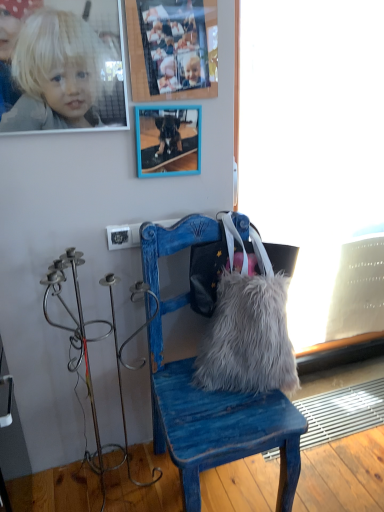
Measure the distance between point (244,432) and camera.

Point (244,432) and camera are 1.26 meters apart from each other.

The image size is (384, 512). In order to click on blue wooden chair at center in this screenshot , I will do `click(217, 421)`.

The height and width of the screenshot is (512, 384). I want to click on wooden photo frame at upper center, which appears as the second picture frame when ordered from the bottom, so (x=172, y=49).

Describe the element at coordinates (56, 72) in the screenshot. I see `blonde hair at upper left` at that location.

This screenshot has width=384, height=512. Describe the element at coordinates (168, 140) in the screenshot. I see `blue wooden picture frame at upper center, the 2th picture frame viewed from the top` at that location.

Locate an element on the screen. blue wooden chair at center is located at coordinates (217, 421).

Measure the distance between fuzzy fabric handbag at center and blonde hair at upper left.

30.07 inches.

The image size is (384, 512). I want to click on person that is above the fuzzy fabric handbag at center (from a real-world perspective), so click(x=56, y=72).

In terms of height, does fuzzy fabric handbag at center look taller or shorter compared to blonde hair at upper left?

Considering their sizes, fuzzy fabric handbag at center has more height than blonde hair at upper left.

Is fuzzy fabric handbag at center positioned with its back to blonde hair at upper left?

No.

Is fuzzy fabric handbag at center facing towards blue wooden picture frame at upper center, the first picture frame when ordered from bottom to top?

No.

Is fuzzy fabric handbag at center not near blue wooden picture frame at upper center, the first picture frame when ordered from bottom to top?

No, fuzzy fabric handbag at center is in close proximity to blue wooden picture frame at upper center, the first picture frame when ordered from bottom to top.

Can you tell me how much fuzzy fabric handbag at center and blue wooden picture frame at upper center, the first picture frame when ordered from bottom to top, differ in facing direction?

1.64 degrees.

Consider the image. From the image's perspective, who appears lower, fuzzy fabric handbag at center or blue wooden picture frame at upper center, the 2th picture frame viewed from the top?

From the image's view, fuzzy fabric handbag at center is below.

Find the location of a particular element. Image resolution: width=384 pixels, height=512 pixels. chair below the blonde hair at upper left (from a real-world perspective) is located at coordinates (217, 421).

From a real-world perspective, does blue wooden chair at center sit lower than blonde hair at upper left?

Yes, from a real-world perspective, blue wooden chair at center is beneath blonde hair at upper left.

How many degrees apart are the facing directions of blue wooden chair at center and blonde hair at upper left?

The angle between the facing direction of blue wooden chair at center and the facing direction of blonde hair at upper left is 0.779 degrees.

Is blue wooden chair at center next to blonde hair at upper left?

blue wooden chair at center and blonde hair at upper left are clearly separated.

Is wooden photo frame at upper center, placed as the 1th picture frame when sorted from top to bottom, closer to the viewer compared to frosted glass window screen at right?

Yes, the depth of wooden photo frame at upper center, placed as the 1th picture frame when sorted from top to bottom, is less than that of frosted glass window screen at right.

Which point is more forward, (152, 35) or (347, 177)?

The point (152, 35) is in front.

Is wooden photo frame at upper center, placed as the 1th picture frame when sorted from top to bottom, far from frosted glass window screen at right?

They are positioned close to each other.

From a real-world perspective, is wooden photo frame at upper center, which appears as the second picture frame when ordered from the bottom, positioned under frosted glass window screen at right based on gravity?

No.

Is blonde hair at upper left to the left of fuzzy fabric handbag at center from the viewer's perspective?

Yes, blonde hair at upper left is to the left of fuzzy fabric handbag at center.

Considering their positions, is blonde hair at upper left located in front of or behind fuzzy fabric handbag at center?

blonde hair at upper left is positioned closer to the viewer than fuzzy fabric handbag at center.

Is blonde hair at upper left far away from fuzzy fabric handbag at center?

No, blonde hair at upper left is not far away from fuzzy fabric handbag at center.

Looking at this image, from the image's perspective, does blonde hair at upper left appear lower than fuzzy fabric handbag at center?

No, from the image's perspective, blonde hair at upper left is not beneath fuzzy fabric handbag at center.

Can you confirm if fuzzy fabric handbag at center is shorter than frosted glass window screen at right?

Yes.

Is there a large distance between fuzzy fabric handbag at center and frosted glass window screen at right?

No, fuzzy fabric handbag at center is in close proximity to frosted glass window screen at right.

Is point (221, 334) positioned after point (274, 158)?

No.

Is fuzzy fabric handbag at center wider or thinner than frosted glass window screen at right?

Clearly, fuzzy fabric handbag at center has more width compared to frosted glass window screen at right.

Considering the positions of objects blue wooden picture frame at upper center, the 2th picture frame viewed from the top, and wooden photo frame at upper center, which appears as the second picture frame when ordered from the bottom, in the image provided, who is in front, blue wooden picture frame at upper center, the 2th picture frame viewed from the top, or wooden photo frame at upper center, which appears as the second picture frame when ordered from the bottom,?

wooden photo frame at upper center, which appears as the second picture frame when ordered from the bottom, is more forward.

How far apart are blue wooden picture frame at upper center, the 2th picture frame viewed from the top, and wooden photo frame at upper center, placed as the 1th picture frame when sorted from top to bottom?

A distance of 6.17 inches exists between blue wooden picture frame at upper center, the 2th picture frame viewed from the top, and wooden photo frame at upper center, placed as the 1th picture frame when sorted from top to bottom.

Which is more to the left, blue wooden picture frame at upper center, the first picture frame when ordered from bottom to top, or wooden photo frame at upper center, placed as the 1th picture frame when sorted from top to bottom?

blue wooden picture frame at upper center, the first picture frame when ordered from bottom to top, is more to the left.

Considering the sizes of objects blue wooden picture frame at upper center, the 2th picture frame viewed from the top, and wooden photo frame at upper center, which appears as the second picture frame when ordered from the bottom, in the image provided, who is smaller, blue wooden picture frame at upper center, the 2th picture frame viewed from the top, or wooden photo frame at upper center, which appears as the second picture frame when ordered from the bottom,?

Smaller between the two is blue wooden picture frame at upper center, the 2th picture frame viewed from the top.

Identify the location of handbag that appears on the right of blonde hair at upper left. (248, 326).

There is a fuzzy fabric handbag at center. Identify the location of the 1st picture frame above it (from the image's perspective). Image resolution: width=384 pixels, height=512 pixels. (168, 140).

Considering their positions, is frosted glass window screen at right positioned closer to blue wooden chair at center than blue wooden picture frame at upper center, the 2th picture frame viewed from the top?

Among the two, blue wooden picture frame at upper center, the 2th picture frame viewed from the top, is located nearer to blue wooden chair at center.

When comparing their distances from blue wooden chair at center, does blue wooden picture frame at upper center, the first picture frame when ordered from bottom to top, or fuzzy fabric handbag at center seem further?

blue wooden picture frame at upper center, the first picture frame when ordered from bottom to top.

Estimate the real-world distances between objects in this image. Which object is closer to blue wooden picture frame at upper center, the first picture frame when ordered from bottom to top, wooden photo frame at upper center, placed as the 1th picture frame when sorted from top to bottom, or fuzzy fabric handbag at center?

wooden photo frame at upper center, placed as the 1th picture frame when sorted from top to bottom, lies closer to blue wooden picture frame at upper center, the first picture frame when ordered from bottom to top, than the other object.

Which object lies further to the anchor point wooden photo frame at upper center, placed as the 1th picture frame when sorted from top to bottom, fuzzy fabric handbag at center or frosted glass window screen at right?

fuzzy fabric handbag at center.

Based on their spatial positions, is frosted glass window screen at right or wooden photo frame at upper center, which appears as the second picture frame when ordered from the bottom, further from blue wooden picture frame at upper center, the 2th picture frame viewed from the top?

frosted glass window screen at right lies further to blue wooden picture frame at upper center, the 2th picture frame viewed from the top, than the other object.

From the image, which object appears to be nearer to blonde hair at upper left, wooden photo frame at upper center, placed as the 1th picture frame when sorted from top to bottom, or fuzzy fabric handbag at center?

wooden photo frame at upper center, placed as the 1th picture frame when sorted from top to bottom.

Estimate the real-world distances between objects in this image. Which object is further from frosted glass window screen at right, fuzzy fabric handbag at center or blue wooden chair at center?

blue wooden chair at center lies further to frosted glass window screen at right than the other object.

Based on their spatial positions, is blue wooden picture frame at upper center, the 2th picture frame viewed from the top, or blue wooden chair at center closer to fuzzy fabric handbag at center?

blue wooden chair at center lies closer to fuzzy fabric handbag at center than the other object.

I want to click on chair located between blonde hair at upper left and frosted glass window screen at right in the left-right direction, so click(x=217, y=421).

Find the location of a particular element. The image size is (384, 512). handbag between blonde hair at upper left and frosted glass window screen at right in the horizontal direction is located at coordinates (248, 326).

Locate an element on the screen. The height and width of the screenshot is (512, 384). picture frame between blonde hair at upper left and wooden photo frame at upper center, placed as the 1th picture frame when sorted from top to bottom, from left to right is located at coordinates pos(168,140).

The image size is (384, 512). What are the coordinates of `window screen between wooden photo frame at upper center, placed as the 1th picture frame when sorted from top to bottom, and fuzzy fabric handbag at center from top to bottom` in the screenshot? It's located at (317, 156).